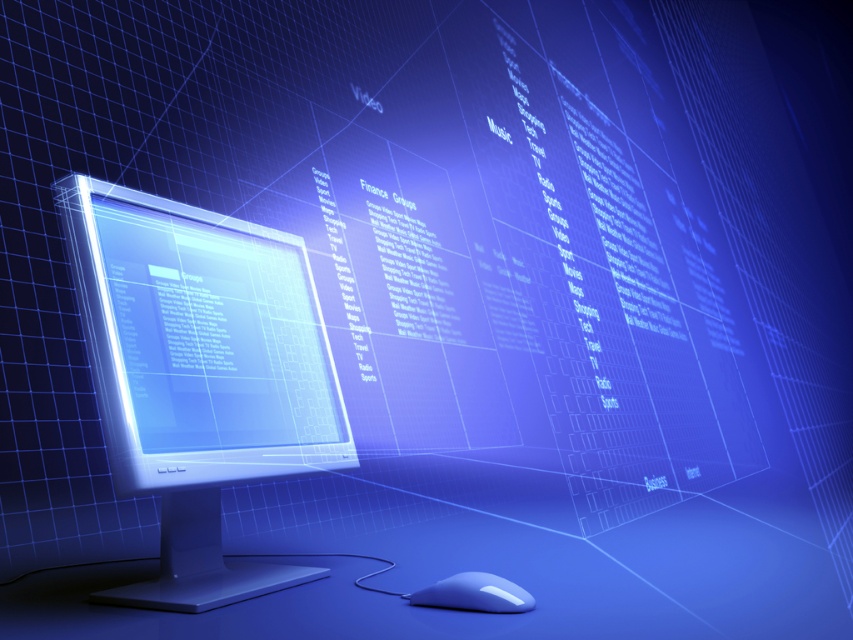
Consider the image. Can you confirm if satin silver monitor at center is positioned above white glossy mouse at lower center?

Yes.

Who is more distant from viewer, [270,584] or [428,588]?

The point [270,584] is behind.

You are a GUI agent. You are given a task and a screenshot of the screen. Output one action in this format:
    pyautogui.click(x=<x>, y=<y>)
    Task: Click on the satin silver monitor at center
    The image size is (853, 640).
    Given the screenshot: What is the action you would take?
    pyautogui.click(x=200, y=374)

Locate an element on the screen. The width and height of the screenshot is (853, 640). satin silver monitor at center is located at coordinates (200, 374).